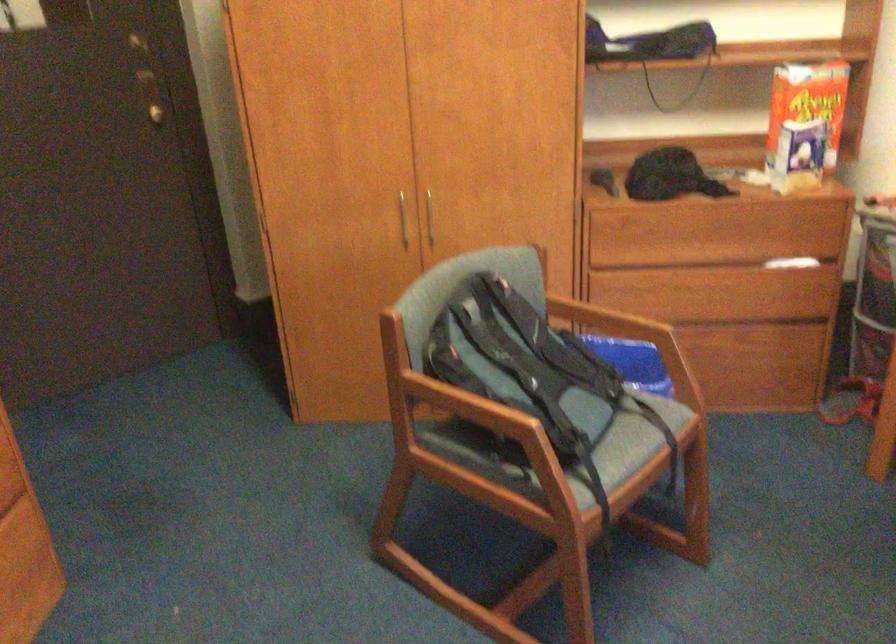
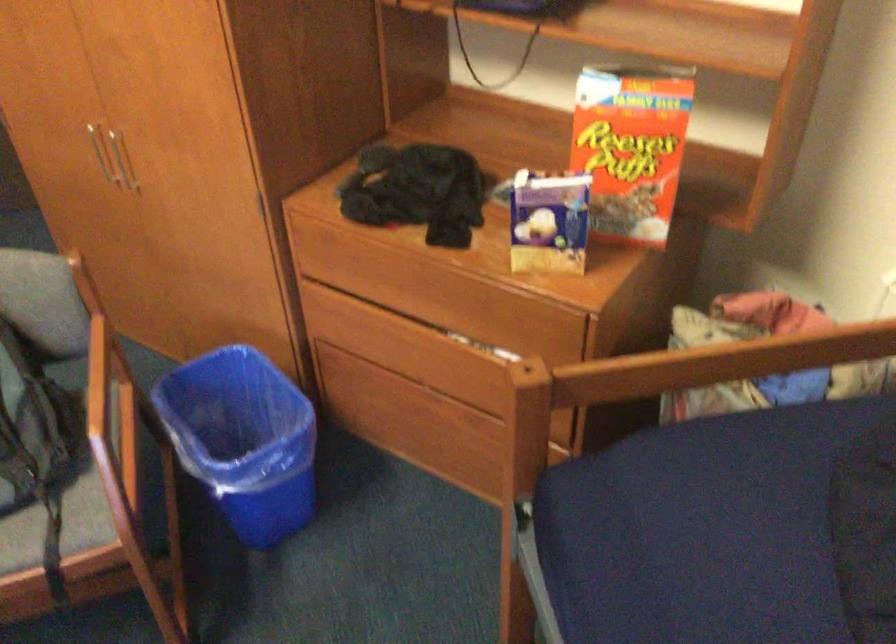
The point at [405,205] is marked in the first image. Where is the corresponding point in the second image?

(97, 149)